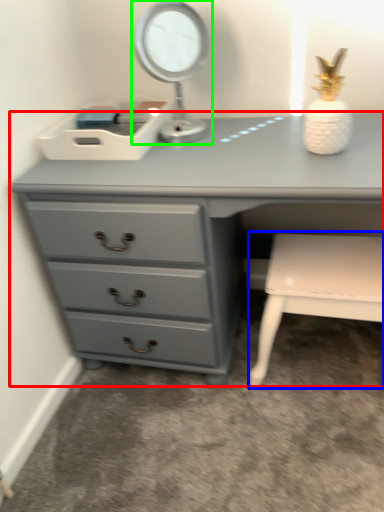
Question: Which object is the closest to the chest of drawers (highlighted by a red box)? Choose among these: chair (highlighted by a blue box) or table lamp (highlighted by a green box).

Choices:
 (A) chair
 (B) table lamp

Answer: (B)